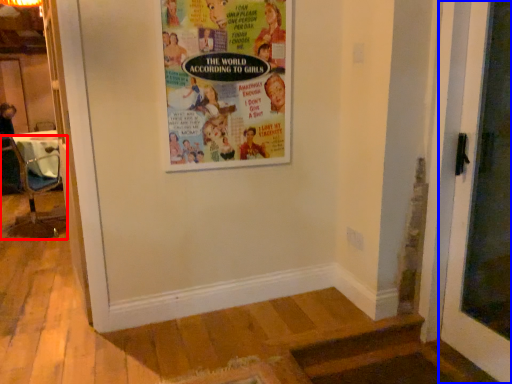
Question: Which object appears farthest to the camera in this image, chair (highlighted by a red box) or door (highlighted by a blue box)?

Choices:
 (A) chair
 (B) door

Answer: (A)